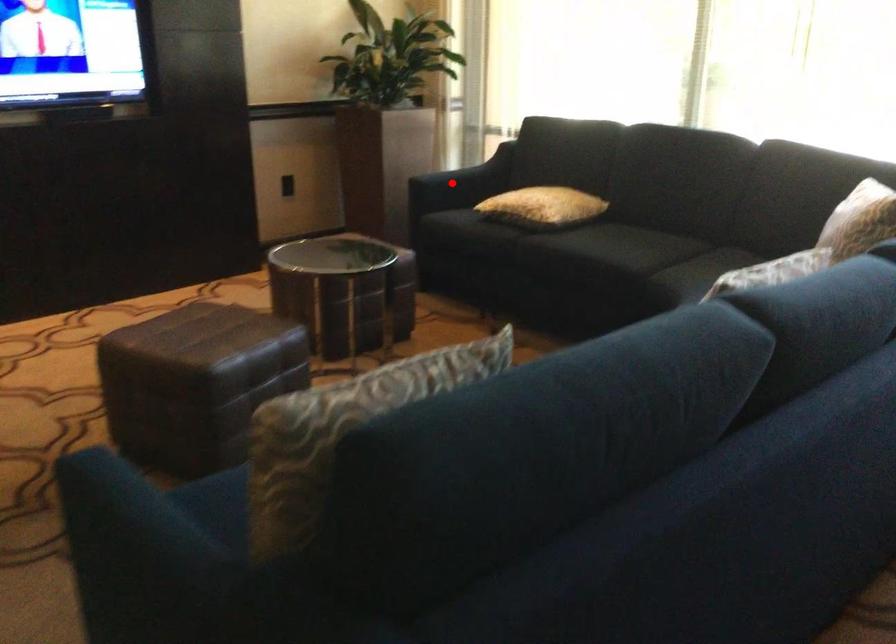
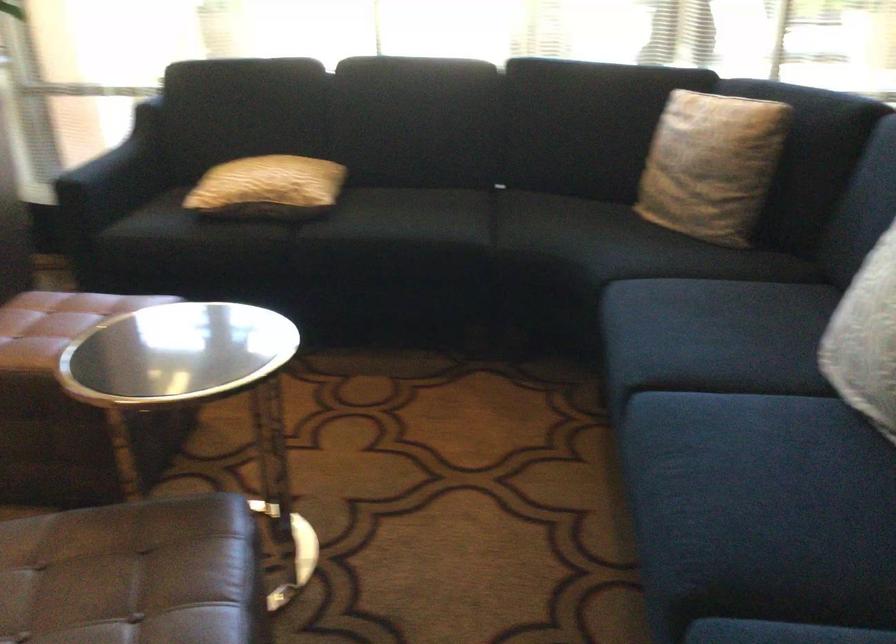
Question: A red point is marked in image1. In image2, is the corresponding 3D point closer to the camera or farther? Reply with the corresponding letter.

Choices:
 (A) The corresponding 3D point is closer.
 (B) The corresponding 3D point is farther.

Answer: (A)